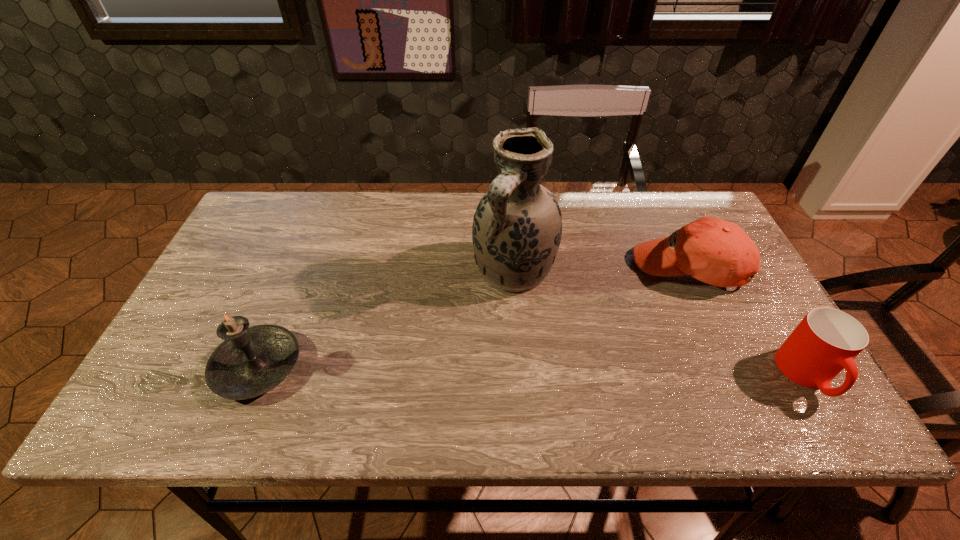
Find the location of `free point at the far edge`. free point at the far edge is located at coordinates (351, 212).

Image resolution: width=960 pixels, height=540 pixels. Identify the location of vacant space at the near edge. (346, 381).

At what (x,y) coordinates should I click in order to perform the action: click on free location at the left edge of the desktop. Please return your answer as a coordinate pair (x, y). This screenshot has width=960, height=540. Looking at the image, I should click on (254, 254).

Image resolution: width=960 pixels, height=540 pixels. What are the coordinates of `blank area at the right edge` in the screenshot? It's located at (710, 304).

In the image, there is a desktop. Identify the location of blank space at the far left corner. The image size is (960, 540). (242, 240).

Find the location of a particular element. The width and height of the screenshot is (960, 540). free space at the far right corner of the desktop is located at coordinates (661, 219).

Where is `blank region between the leftmost object and the cup`? This screenshot has width=960, height=540. blank region between the leftmost object and the cup is located at coordinates (532, 371).

Locate an element on the screen. This screenshot has height=540, width=960. vacant space in between the leftmost object and the third object from right to left is located at coordinates (x=386, y=319).

This screenshot has width=960, height=540. What are the coordinates of `vacant area that lies between the cup and the tallest object` in the screenshot? It's located at (660, 323).

This screenshot has height=540, width=960. I want to click on free space that is in between the baseball cap and the third shortest object, so click(x=472, y=318).